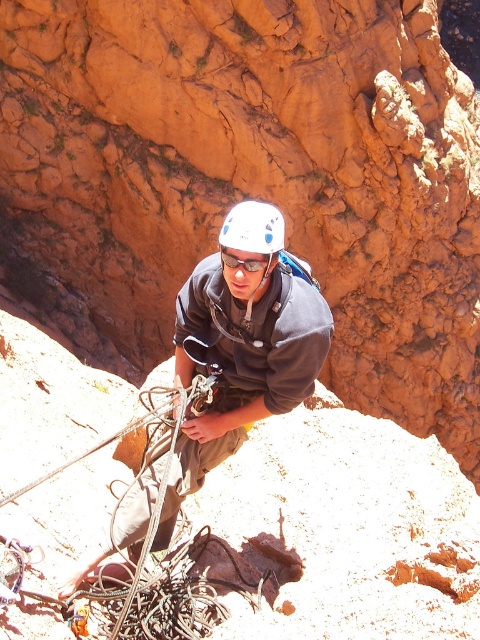
You are a safety inspector checking the gear of a climber. You notice the white matte helmet at center and the clear plastic goggles at center. Which gear item is taller?

The white matte helmet at center is taller than the clear plastic goggles at center.

What is the exact coordinate of the matte gray helmet at center in the image?

The matte gray helmet at center is located at coordinate point (241, 346).

What are the coordinates of the white matte helmet at center in the image?

The white matte helmet at center is located at point coordinates (252, 230).